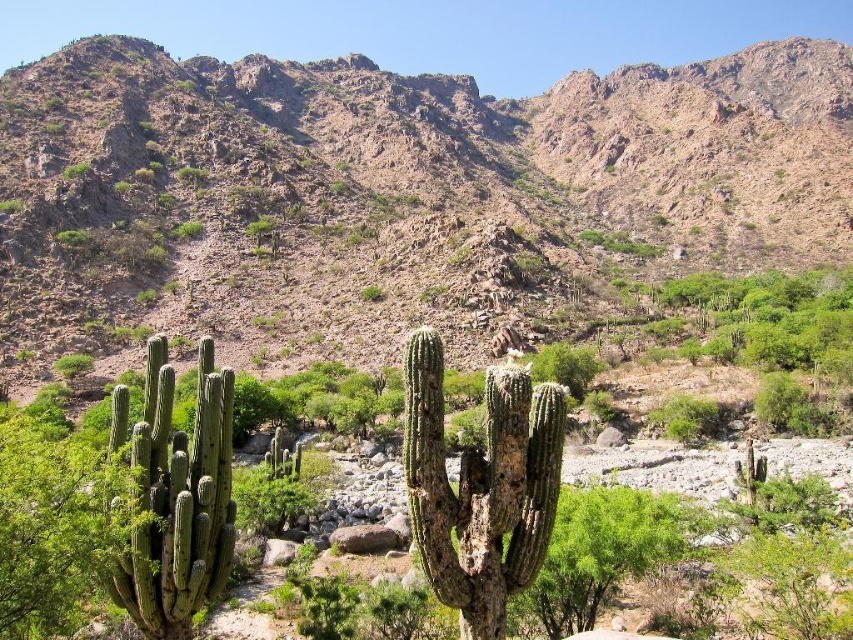
You are planning to build a hiking trail in the desert. The trail must pass between the rugged rock mountain at upper center and the green rough cactus at left. Considering their widths, which side of the trail should be wider to accommodate more hikers?

The rugged rock mountain at upper center is wider than the green rough cactus at left. Therefore, the side of the trail near the rugged rock mountain at upper center should be made wider to accommodate more hikers.

You are a hiker trying to take a photo of the rugged rock mountain at upper center. You notice the green rough cactus at center is blocking your view. Can you move the cactus to get a clear shot of the mountain?

The green rough cactus at center is behind the rugged rock mountain at upper center, so moving it won wait help because the mountain is in front of the cactus and already blocking the view.

You are a hiker planning to climb the rugged rock mountain at upper center. From your current position at the base of the green rough cactus at center, which direction should you head to reach the mountain?

The rugged rock mountain at upper center is above the green rough cactus at center, so you should head upward from the green rough cactus at center to reach the rugged rock mountain at upper center.